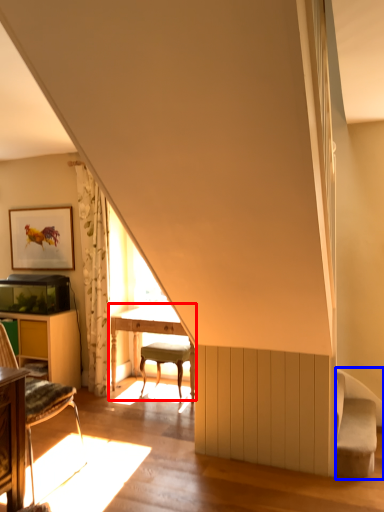
Question: Which of the following is the closest to the observer, table (highlighted by a red box) or swivel chair (highlighted by a blue box)?

Choices:
 (A) table
 (B) swivel chair

Answer: (B)